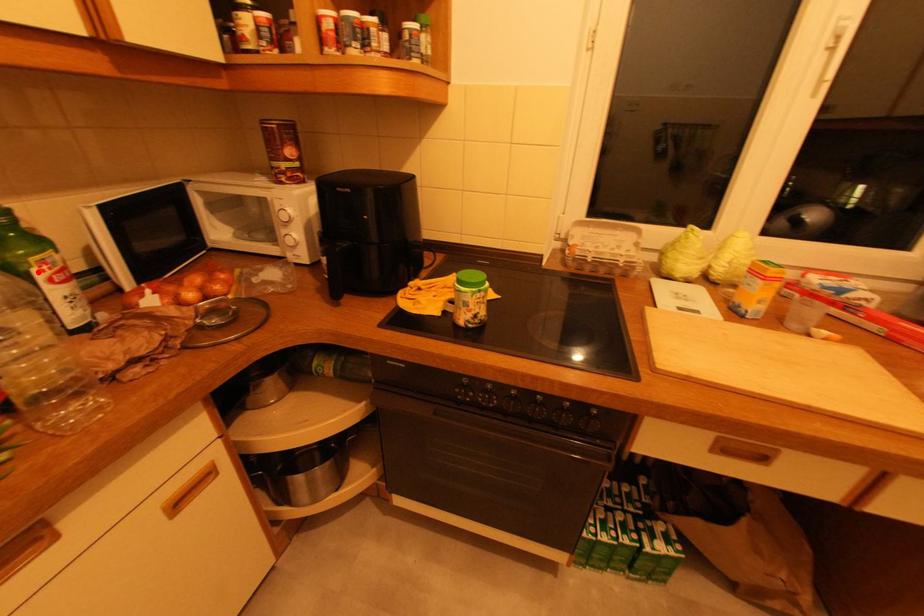
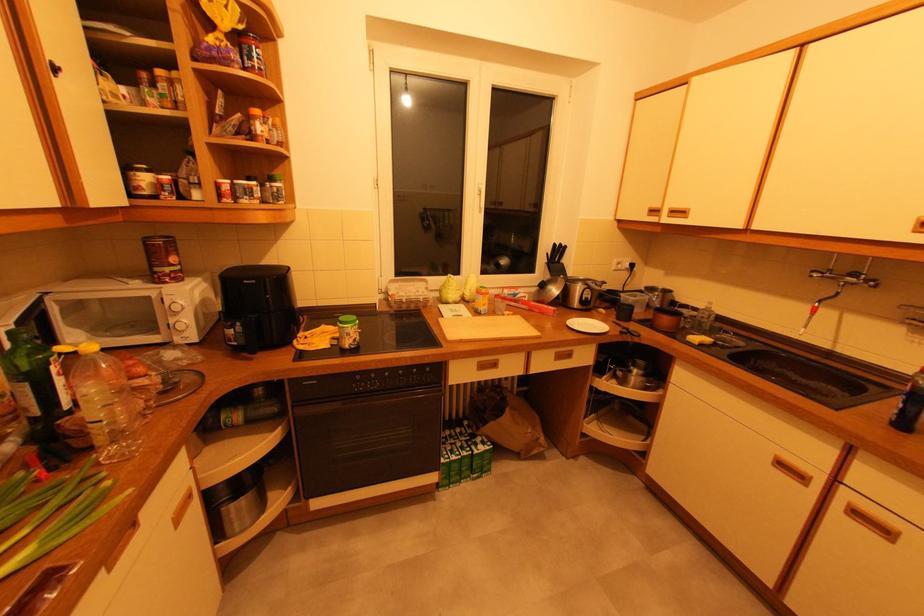
Where in the second image is the point corresponding to the highlighted location from the first image?

(55, 368)